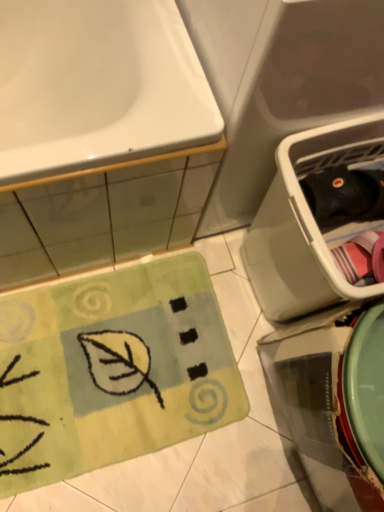
Question: Is white glossy sink at upper left wider or thinner than black plastic dish washer at right?

Choices:
 (A) wide
 (B) thin

Answer: (A)

Question: From the image's perspective, is white glossy sink at upper left positioned above or below black plastic dish washer at right?

Choices:
 (A) above
 (B) below

Answer: (A)

Question: Which object is positioned farthest from the green plush doormat at lower left?

Choices:
 (A) white glossy sink at upper left
 (B) black plastic dish washer at right

Answer: (A)

Question: Which of these objects is positioned closest to the white glossy sink at upper left?

Choices:
 (A) black plastic dish washer at right
 (B) green plush doormat at lower left

Answer: (A)